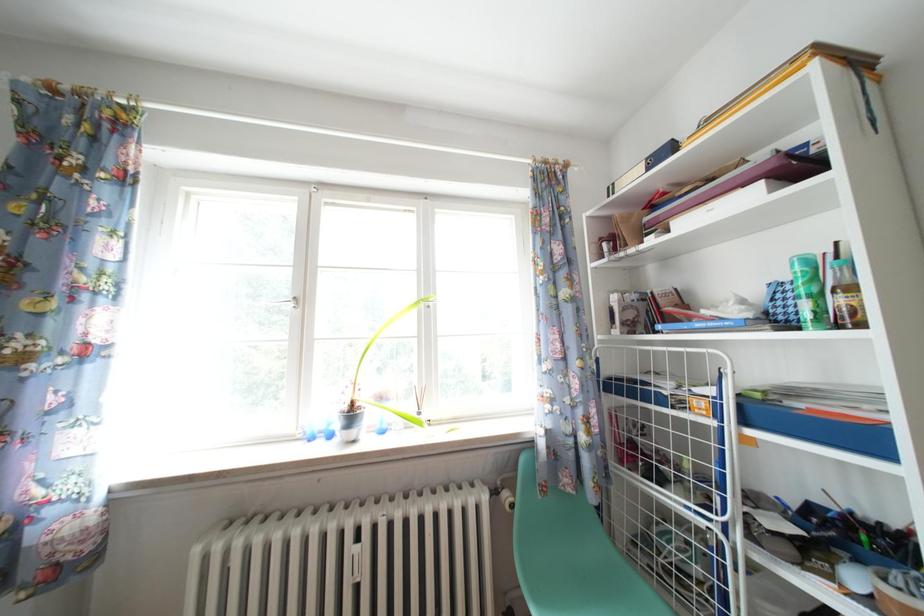
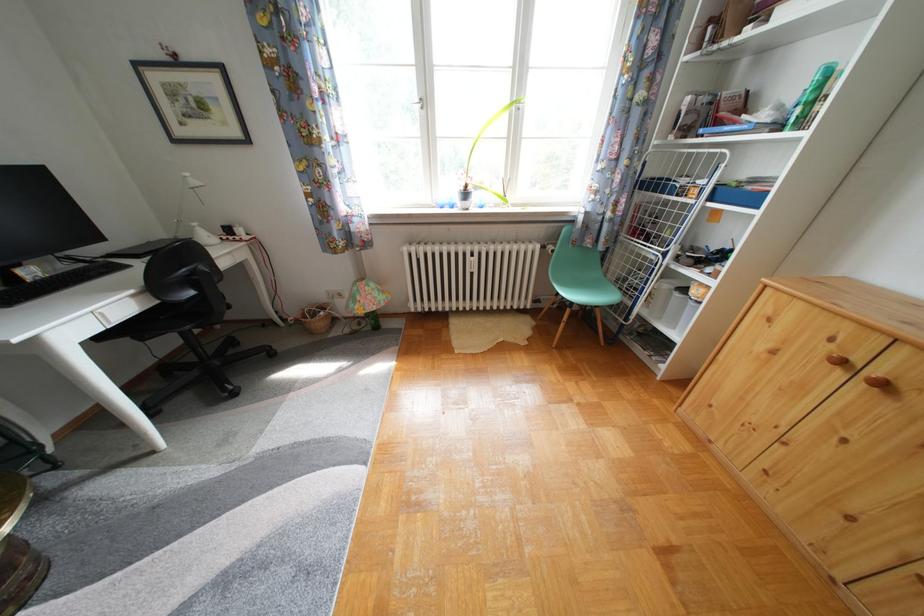
Question: The images are taken continuously from a first-person perspective. In which direction is your viewpoint rotating?

Choices:
 (A) Left
 (B) Right
 (C) Up
 (D) Down

Answer: (D)